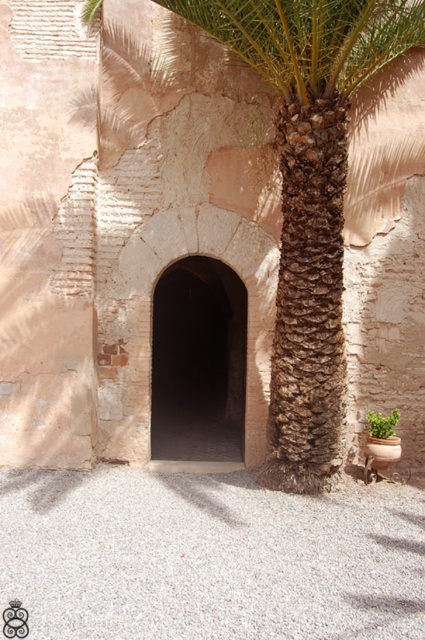
You are standing in front of the rustic stone wall with the arched doorway. There is a point marked at coordinates [198,362]. According to the scene description, where exactly is this point located?

The point at coordinates [198,362] is located on the dark stone arch at center.

You are standing in front of the scene and want to take a photo of the dark stone arch at center without the brown textured palm tree at center blocking it. What should you do?

The brown textured palm tree at center is in front of the dark stone arch at center, so you should move to a position where the palm tree is no longer between you and the arch, such as moving to the side or adjusting your angle to frame around it.

You are standing in front of the dark stone arch at center and want to walk to the green leafy plant at lower right. Which direction should you move relative to the arch?

You should move to the right relative to the dark stone arch at center because the green leafy plant at lower right is located to the right of the dark stone arch at center.